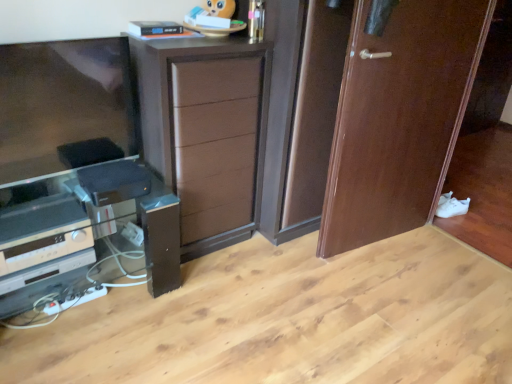
Identify the location of empty space that is ontop of silver metallic stereo at lower left. The image size is (512, 384). (39, 220).